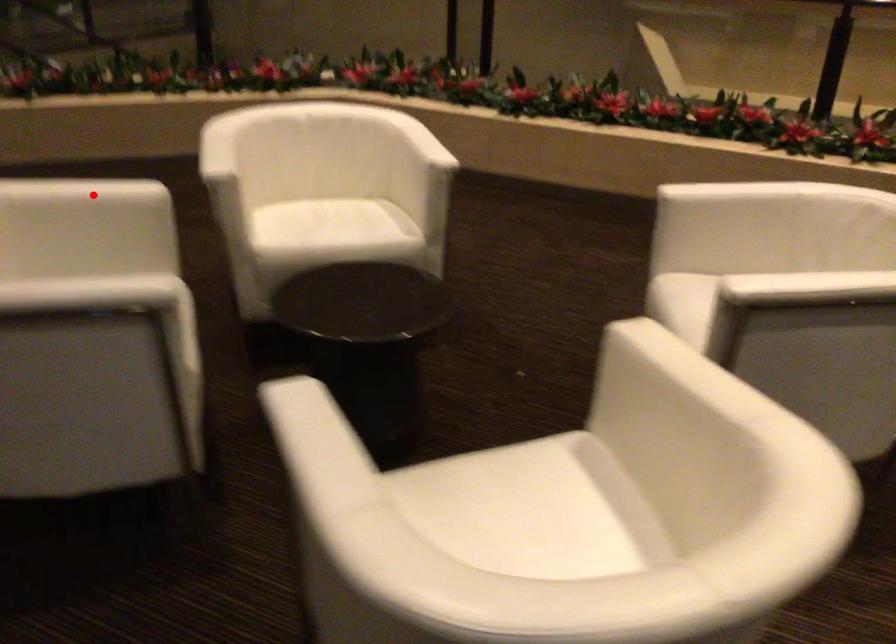
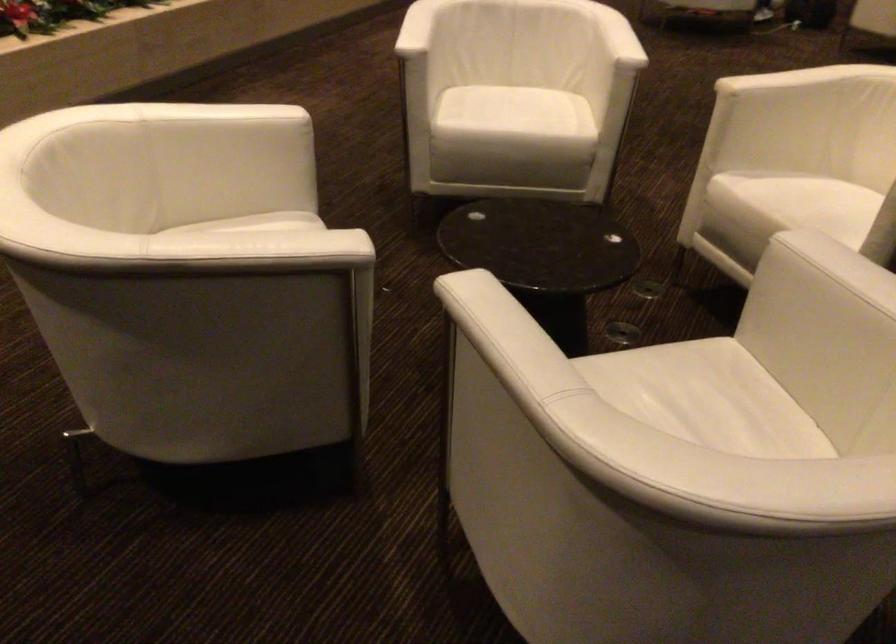
Question: I am providing you with two images of the same scene from different viewpoints. Given a red point in image1, look at the same physical point in image2. Is it:

Choices:
 (A) Closer to the viewpoint
 (B) Farther from the viewpoint

Answer: (A)